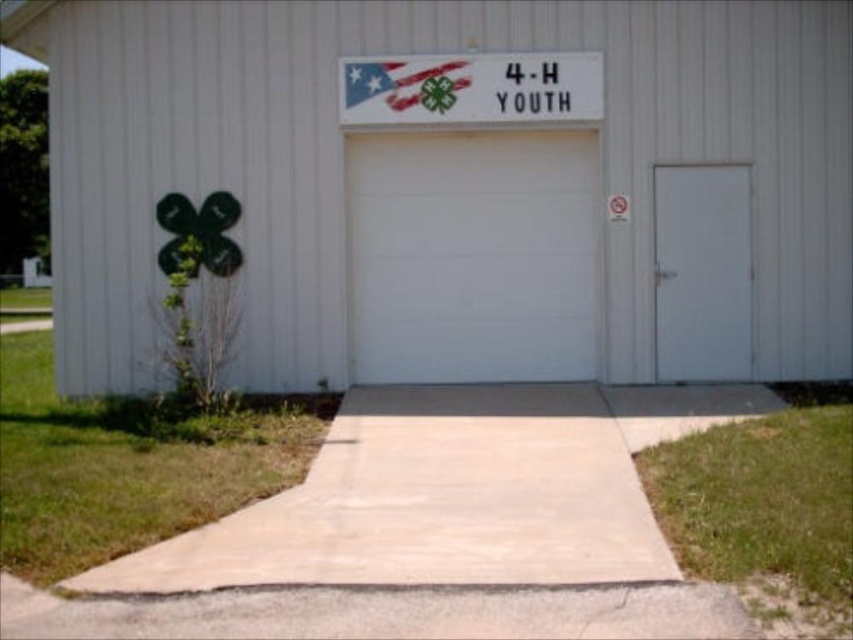
Question: Does white smooth garage door at center come behind white plastic sign at upper center?

Choices:
 (A) no
 (B) yes

Answer: (B)

Question: Based on their relative distances, which object is farther from the white plastic sign at upper center?

Choices:
 (A) white matte garage door at center
 (B) white matte door at center

Answer: (B)

Question: Is white matte garage door at center smaller than white plastic sign at upper center?

Choices:
 (A) no
 (B) yes

Answer: (A)

Question: Which of the following is the closest to the observer?

Choices:
 (A) pyautogui.click(x=840, y=296)
 (B) pyautogui.click(x=717, y=321)

Answer: (A)

Question: Which point appears farthest from the camera in this image?

Choices:
 (A) (558, 218)
 (B) (479, 83)
 (C) (469, 132)

Answer: (A)

Question: Is white matte door at center in front of white plastic sign at upper center?

Choices:
 (A) yes
 (B) no

Answer: (B)